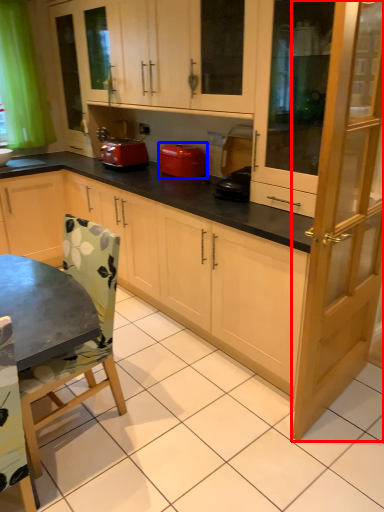
Question: Which object is closer to the camera taking this photo, screen door (highlighted by a red box) or home appliance (highlighted by a blue box)?

Choices:
 (A) screen door
 (B) home appliance

Answer: (A)